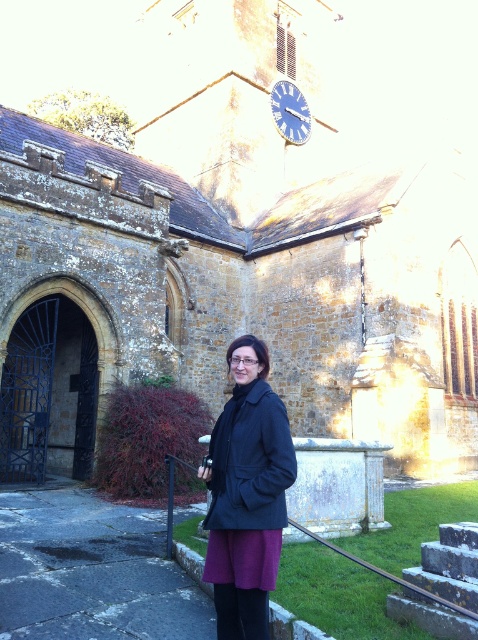
Question: Considering the relative positions of dark blue coat at center and blue metallic clock at upper center in the image provided, where is dark blue coat at center located with respect to blue metallic clock at upper center?

Choices:
 (A) above
 (B) below

Answer: (B)

Question: Does dark blue coat at center appear on the right side of blue metallic clock at upper center?

Choices:
 (A) yes
 (B) no

Answer: (B)

Question: Among these points, which one is nearest to the camera?

Choices:
 (A) (276, 532)
 (B) (274, 108)

Answer: (A)

Question: Can you confirm if dark blue coat at center is wider than blue metallic clock at upper center?

Choices:
 (A) no
 (B) yes

Answer: (A)

Question: Which of the following is the farthest from the observer?

Choices:
 (A) (282, 134)
 (B) (271, 465)

Answer: (A)